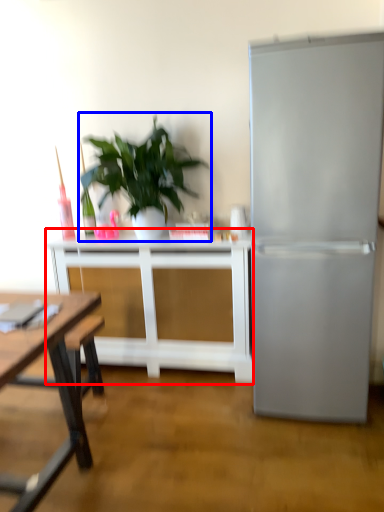
Question: Which object appears closest to the camera in this image, table (highlighted by a red box) or houseplant (highlighted by a blue box)?

Choices:
 (A) table
 (B) houseplant

Answer: (B)